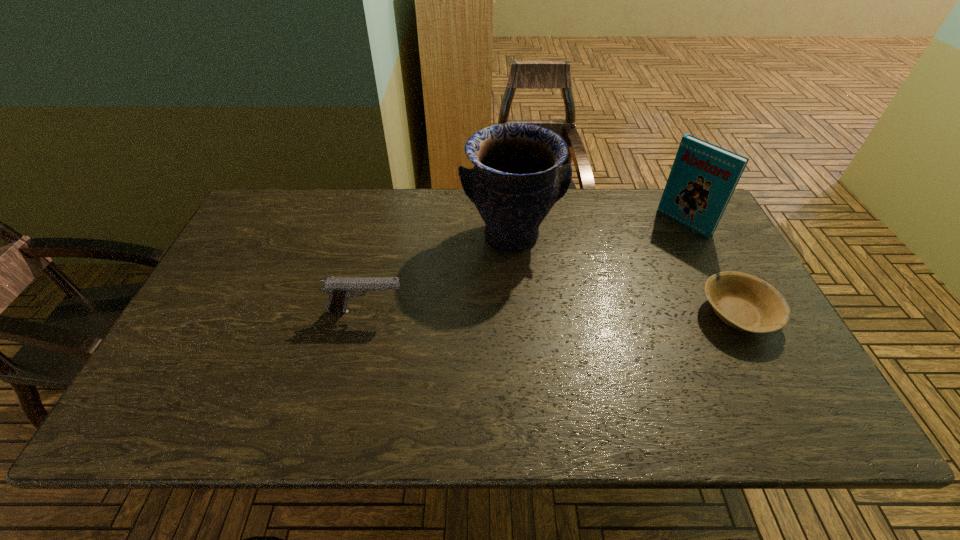
At what (x,y) coordinates should I click in order to perform the action: click on blank space located on the front handle of the third object from right to left. Please return your answer as a coordinate pair (x, y). Looking at the image, I should click on (552, 380).

This screenshot has width=960, height=540. Identify the location of vacant region located 0.280m on the front handle of the third object from right to left. (542, 347).

Where is `free space located 0.120m on the front handle of the third object from right to left`? The image size is (960, 540). free space located 0.120m on the front handle of the third object from right to left is located at coordinates (529, 297).

At what (x,y) coordinates should I click in order to perform the action: click on book located in the far edge section of the desktop. Please return your answer as a coordinate pair (x, y). Looking at the image, I should click on (703, 177).

The image size is (960, 540). Find the location of `pottery situated at the far edge`. pottery situated at the far edge is located at coordinates (517, 179).

This screenshot has width=960, height=540. In order to click on bowl located in the right edge section of the desktop in this screenshot , I will do `click(745, 302)`.

Find the location of a particular element. This screenshot has height=540, width=960. book that is at the right edge is located at coordinates (703, 177).

Locate an element on the screen. object that is positioned at the far right corner is located at coordinates (703, 177).

Image resolution: width=960 pixels, height=540 pixels. In the image, there is a desktop. What are the coordinates of `vacant area at the far edge` in the screenshot? It's located at (357, 195).

The image size is (960, 540). Find the location of `blank space at the near edge of the desktop`. blank space at the near edge of the desktop is located at coordinates (697, 361).